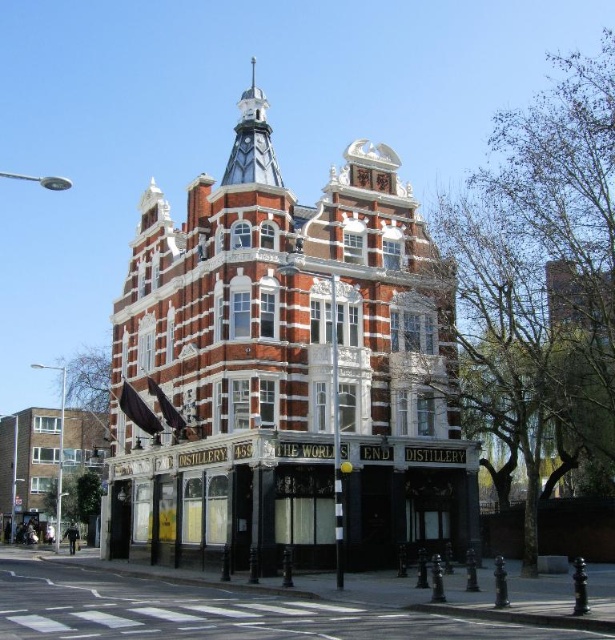
You are standing on the sidewalk in front of The World Distillery. You want to take a photo of the red brick building at center from a distance that will capture the entire structure without cropping any part of it. Considering the camera you have can focus up to 200 feet, will you be able to take the photo from where you are standing?

The distance between you and the red brick building at center is 164.90 feet, which is within the camera focus range of 200 feet. Therefore, you can take the photo from your current position and capture the entire building without cropping.

You are standing in front of The World... Distillery and want to take a photo of the point at coordinate (140,548). If your camera has a maximum focusing distance of 70 meters, will it be able to focus on that point?

The point at coordinate (140,548) is 69.90 meters away from the viewer. Since the camera can focus up to 70 meters, it will be able to focus on the point as the distance is within the camera range.

You are standing on the street in front of the red brick building at center and the white brick building at lower left. Which building is positioned higher relative to the other?

The red brick building at center is located above the white brick building at lower left, so it is positioned higher.